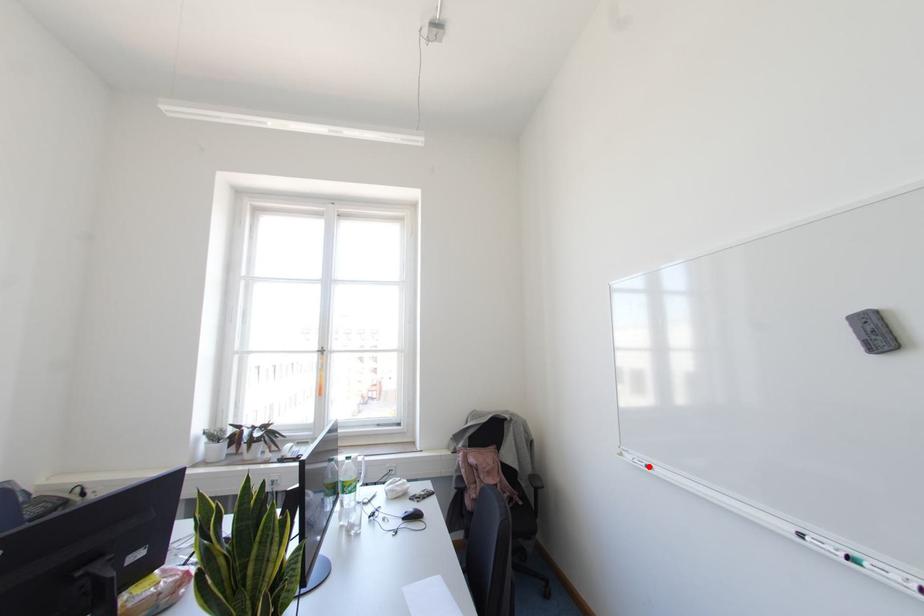
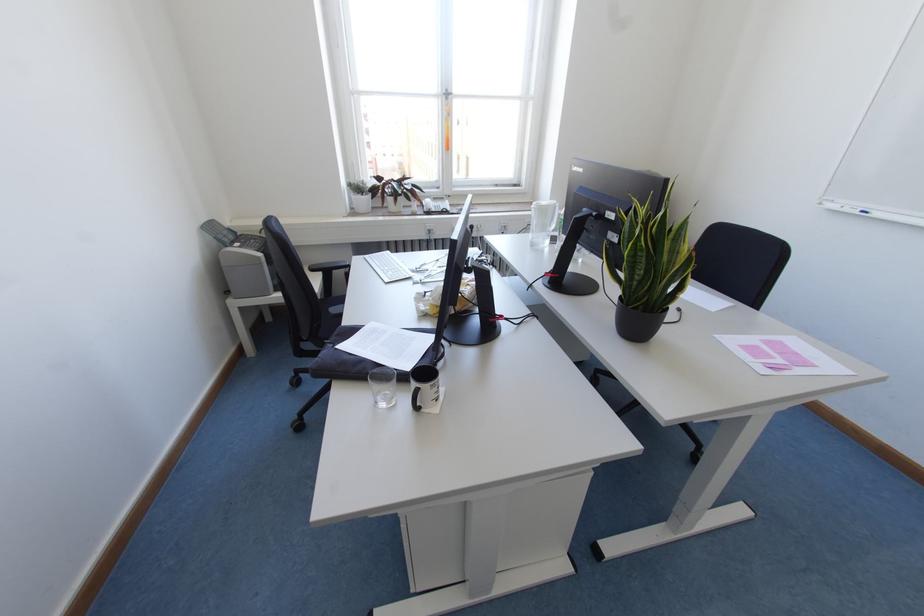
Locate, in the second image, the point that corresponds to the highlighted location in the first image.

(864, 213)